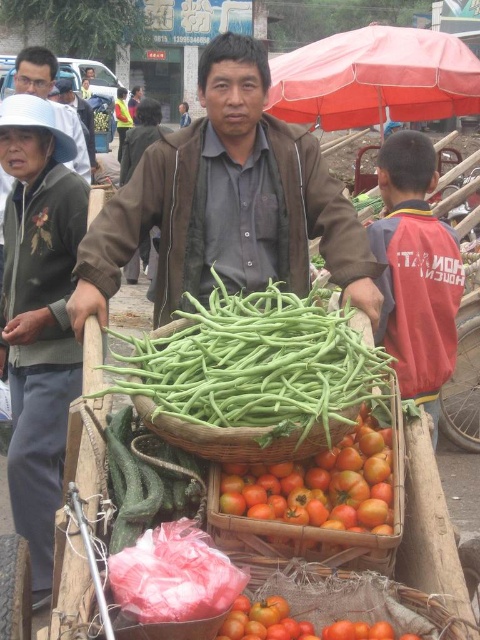
You are standing at the center of the market and see the man pushing the wooden cart with two large woven baskets. There is a green matte cucumber at lower left located at point (x=147, y=481). If you want to buy the cucumber, which direction should you move relative to the man pushing the wooden cart?

The green matte cucumber at lower left is located at point (x=147, y=481), which is to the lower left of the man pushing the wooden cart. Therefore, you should move towards the lower left direction relative to the man to reach the cucumber.

You are a customer at the market and want to buy the green matte cucumber at lower left. Where should you look on the cart to find it?

The green matte cucumber at lower left is located at the 2D coordinates point (147,481) on the cart.